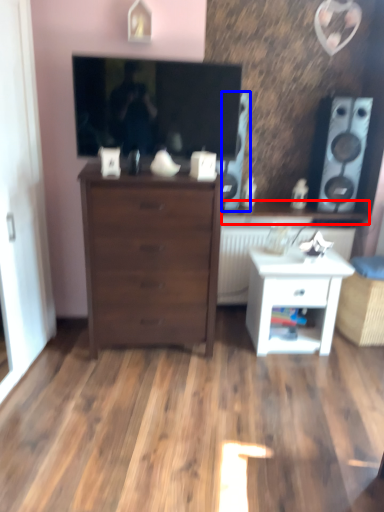
Question: Which point is further to the camera, counter top (highlighted by a red box) or speaker (highlighted by a blue box)?

Choices:
 (A) counter top
 (B) speaker

Answer: (A)